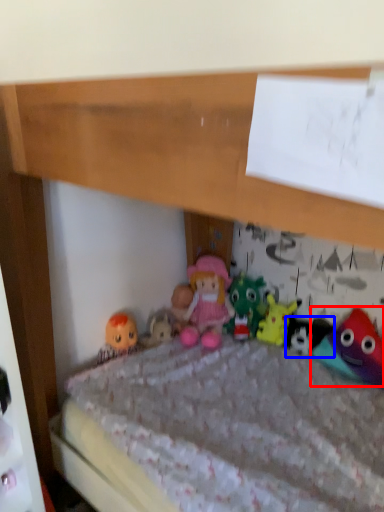
Question: Which of the following is the closest to the observer, toy (highlighted by a red box) or toy (highlighted by a blue box)?

Choices:
 (A) toy
 (B) toy

Answer: (A)